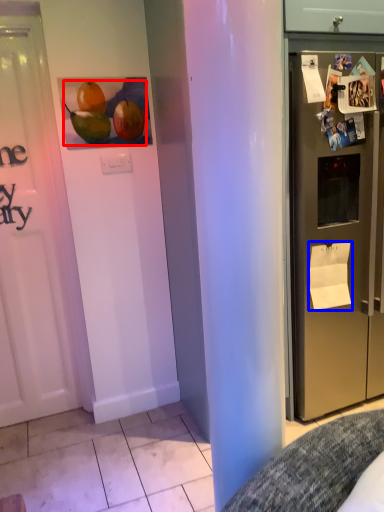
Question: Which of the following is the farthest to the observer, fruit (highlighted by a red box) or paper (highlighted by a blue box)?

Choices:
 (A) fruit
 (B) paper

Answer: (B)